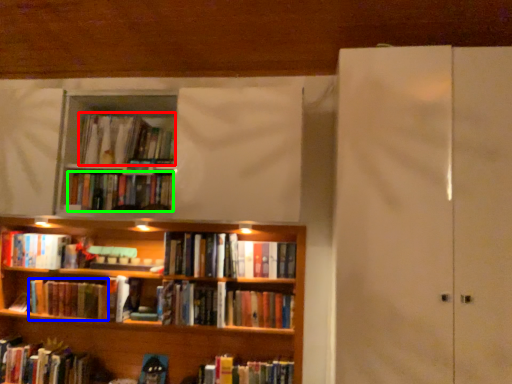
Question: Which is farther away from book (highlighted by a red box)? book (highlighted by a blue box) or book (highlighted by a green box)?

Choices:
 (A) book
 (B) book

Answer: (A)